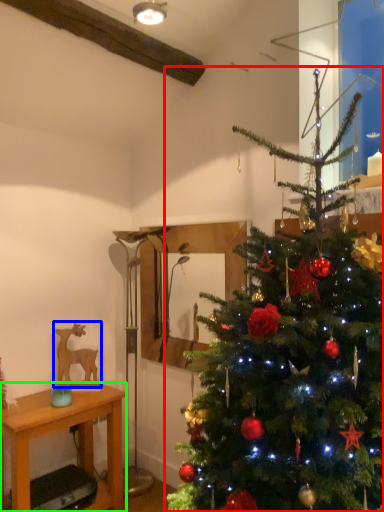
Question: Based on their relative distances, which object is nearer to christmas tree (highlighted by a red box)? Choose from animal (highlighted by a blue box) and desk (highlighted by a green box).

Choices:
 (A) animal
 (B) desk

Answer: (B)